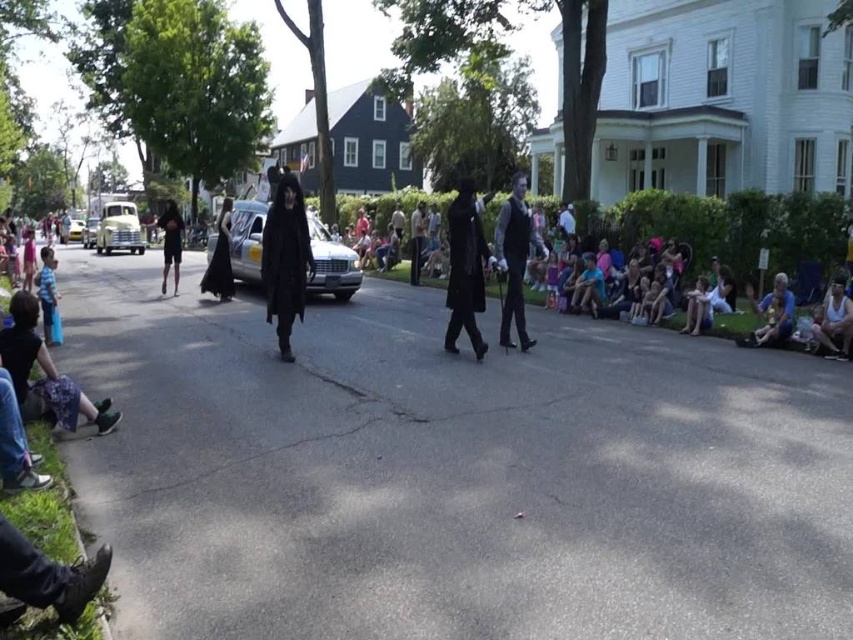
Does white cotton tank top at lower right have a greater width compared to yellow matte car at center?

No.

Consider the image. Is white cotton tank top at lower right further to camera compared to yellow matte car at center?

No, it is not.

Which is in front, point (840, 301) or point (132, 205)?

Positioned in front is point (840, 301).

The height and width of the screenshot is (640, 853). Find the location of `white cotton tank top at lower right`. white cotton tank top at lower right is located at coordinates (834, 321).

Which is below, black matte coat at center or yellow matte car at center?

black matte coat at center is below.

From the picture: Is black matte coat at center closer to the viewer compared to yellow matte car at center?

Yes.

Is point (283, 209) more distant than point (119, 220)?

No.

Image resolution: width=853 pixels, height=640 pixels. In order to click on black matte coat at center in this screenshot , I will do `click(285, 259)`.

Measure the distance between point (224, 237) and camera.

Point (224, 237) and camera are 13.88 meters apart.

Can you confirm if black matte dress at center is positioned above metallic silver car at center?

Incorrect, black matte dress at center is not positioned above metallic silver car at center.

Who is more distant from viewer, (x=227, y=237) or (x=77, y=225)?

The point (x=77, y=225) is behind.

You are a GUI agent. You are given a task and a screenshot of the screen. Output one action in this format:
    pyautogui.click(x=<x>, y=<y>)
    Task: Click on the black matte dress at center
    Image resolution: width=853 pixels, height=640 pixels.
    Given the screenshot: What is the action you would take?
    pyautogui.click(x=219, y=259)